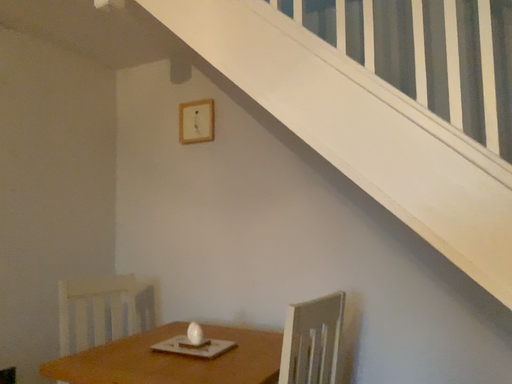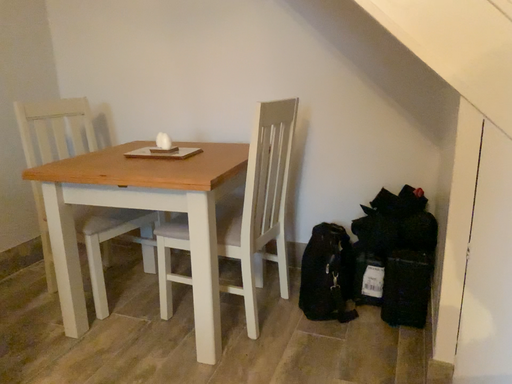
Question: How did the camera likely rotate when shooting the video?

Choices:
 (A) rotated right
 (B) rotated left

Answer: (A)